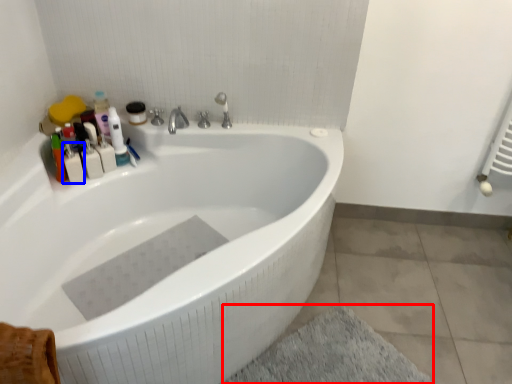
Question: Among these objects, which one is farthest to the camera, bath mat (highlighted by a red box) or toiletry (highlighted by a blue box)?

Choices:
 (A) bath mat
 (B) toiletry

Answer: (B)